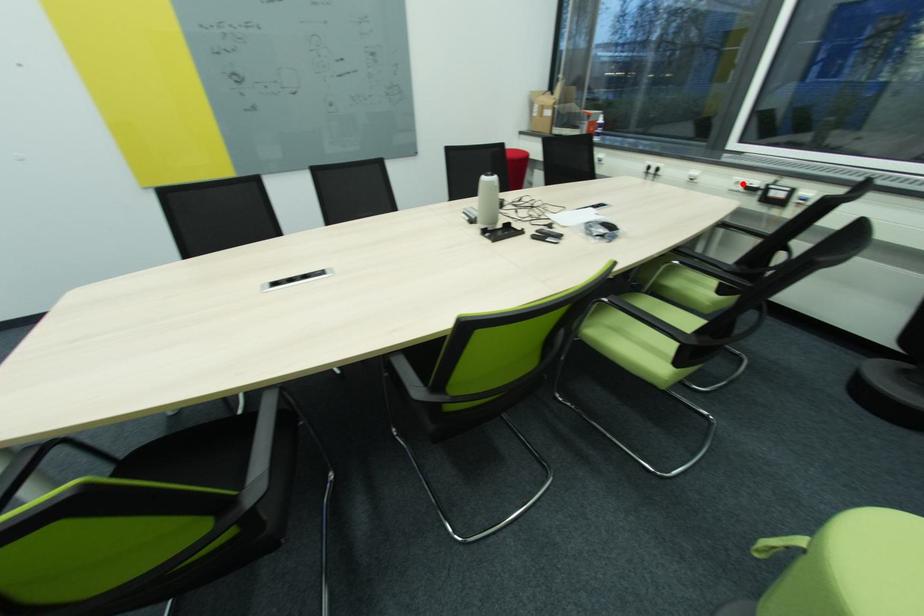
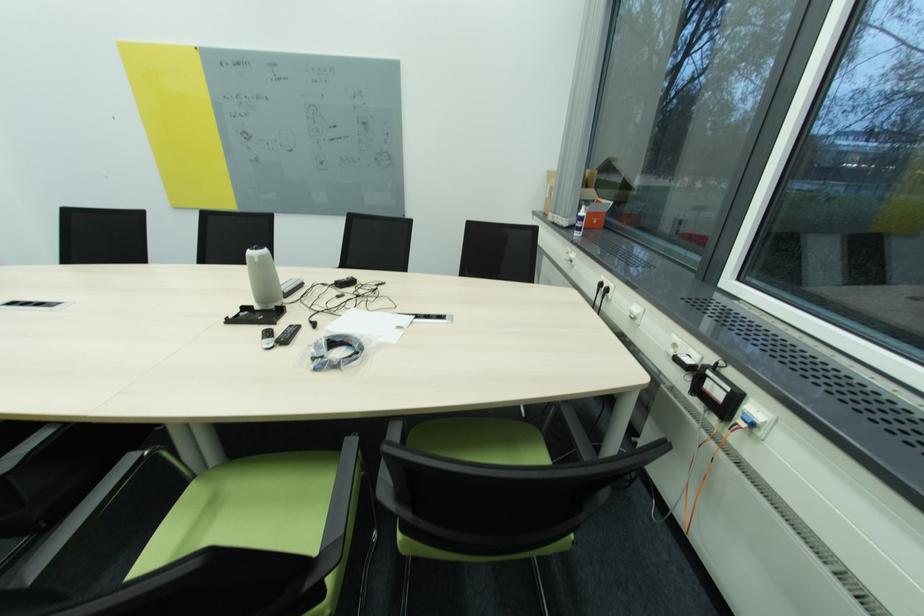
Where in the second image is the point corresponding to the highlighted location from the first image?

(679, 346)